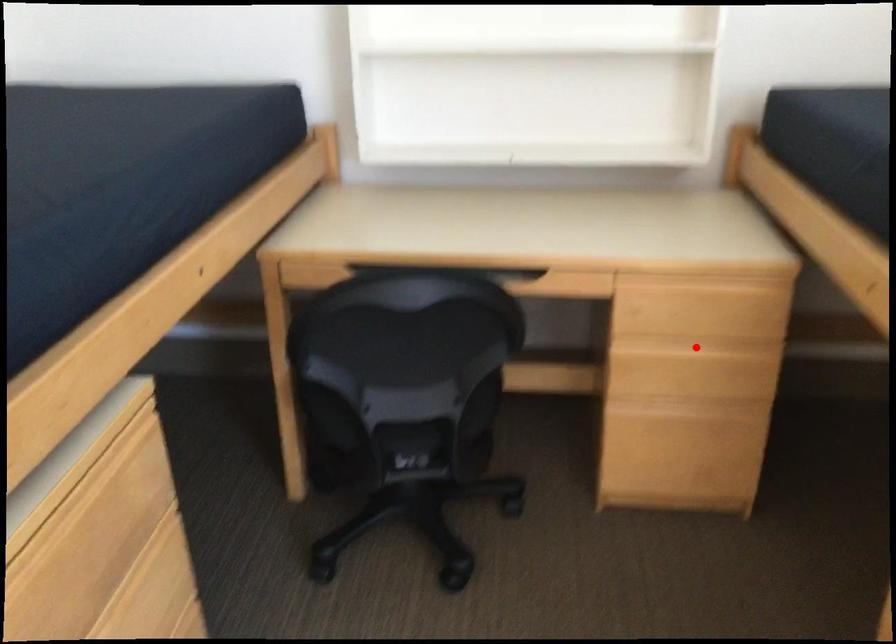
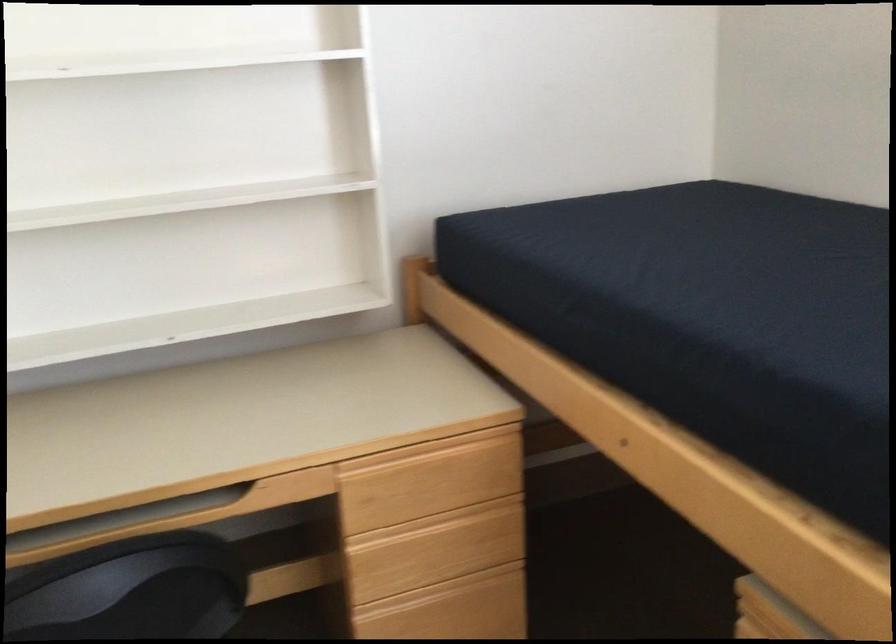
Find the pixel in the second image that matches the highlighted location in the first image.

(443, 524)